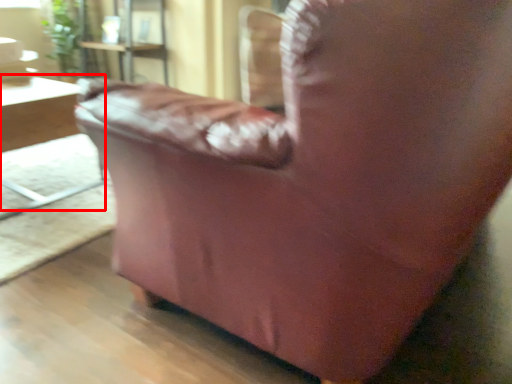
Question: Considering the relative positions of table (annotated by the red box) and plant in the image provided, where is table (annotated by the red box) located with respect to the staircase?

Choices:
 (A) left
 (B) right

Answer: (B)